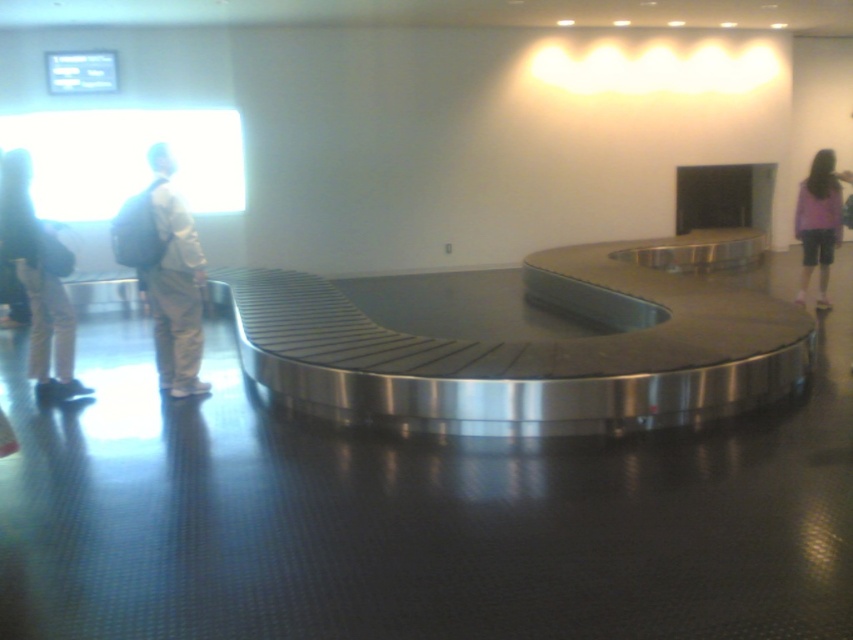
You are a traveler at the airport baggage claim area. You see a matte black backpack at left and a matte khaki pants at left. If you want to grab your luggage quickly, which item should you reach for first, considering their distances from your current position?

The matte khaki pants at left is closer to you than the matte black backpack at left since it is only 27.33 inches away. Therefore, you should reach for the matte khaki pants at left first.

You are a baggage handler at the airport and need to place both the matte black backpack at left and the purple fabric shorts at right onto the empty conveyor belt. Given their sizes, which object should you place first to ensure they both fit on the conveyor belt without overlapping?

The matte black backpack at left is wider than the purple fabric shorts at right. To ensure both fit without overlapping, place the wider matte black backpack at left first, then position the narrower purple fabric shorts at right next to it.

You are at the airport baggage claim area and see two pieces of luggage on the conveyor belt. You need to determine which one is larger. The two items are the matte khaki pants at left and the purple fabric shorts at right. Which one is bigger?

The matte khaki pants at left is bigger than the purple fabric shorts at right.